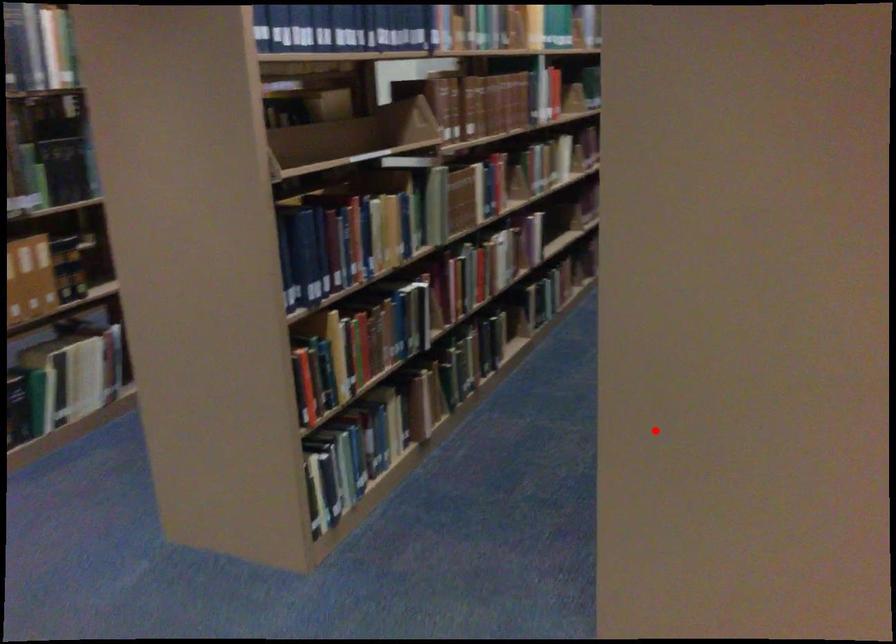
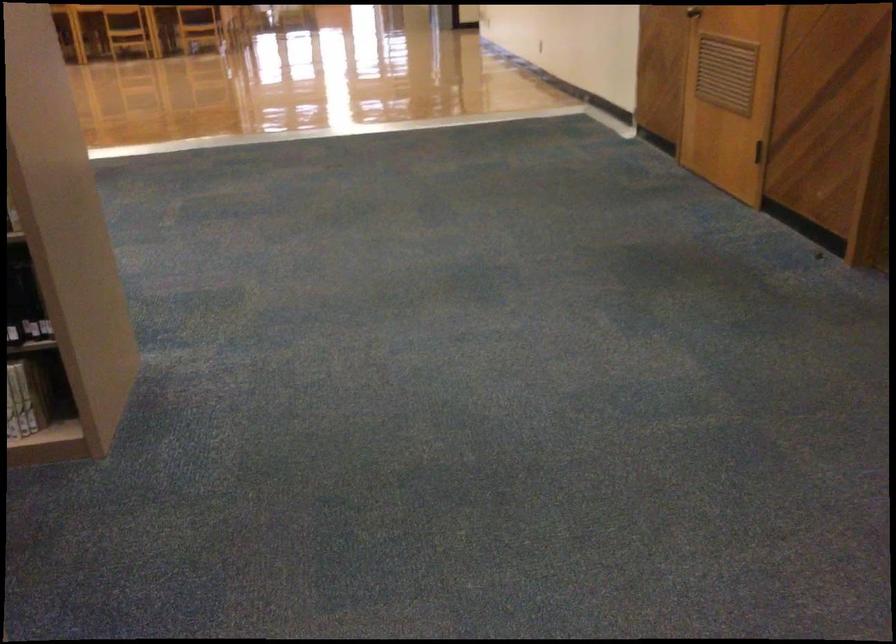
Locate, in the second image, the point that corresponds to the highlighted location in the first image.

(23, 299)